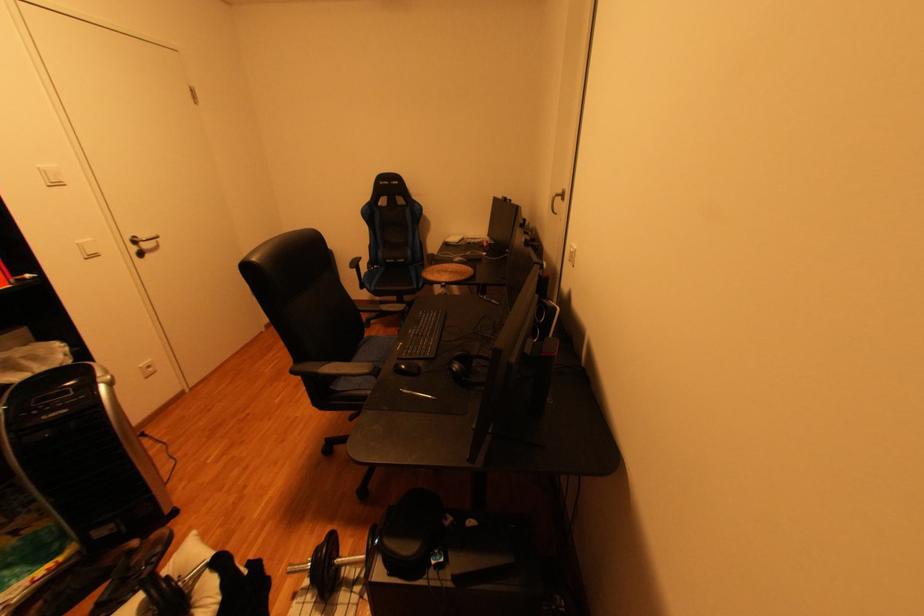
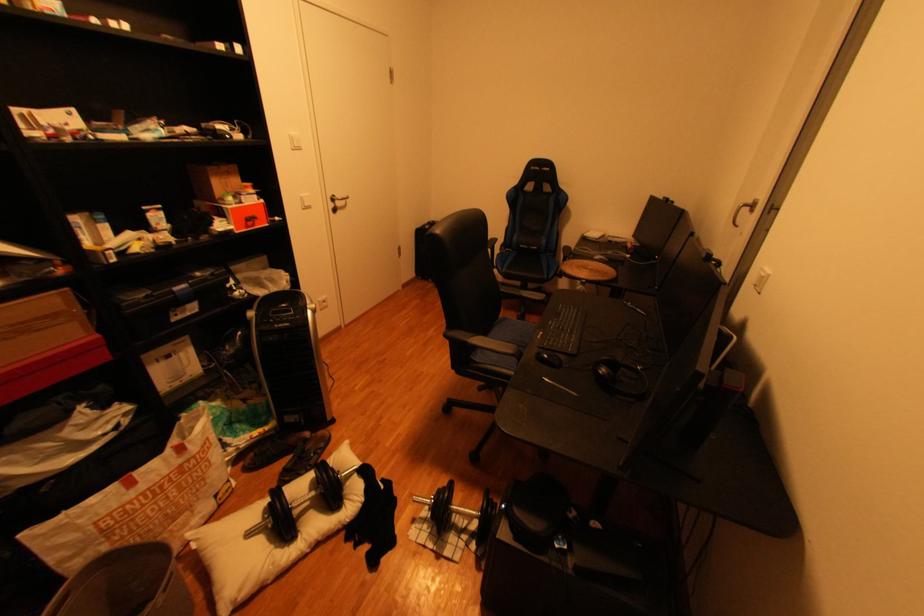
Where in the second image is the point corresponding to (578,262) from the first image?

(763, 286)